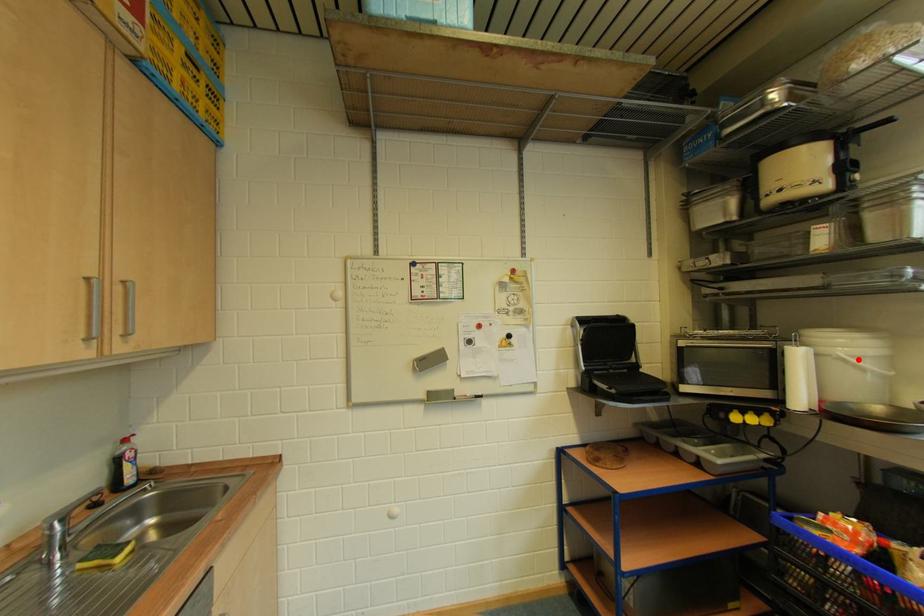
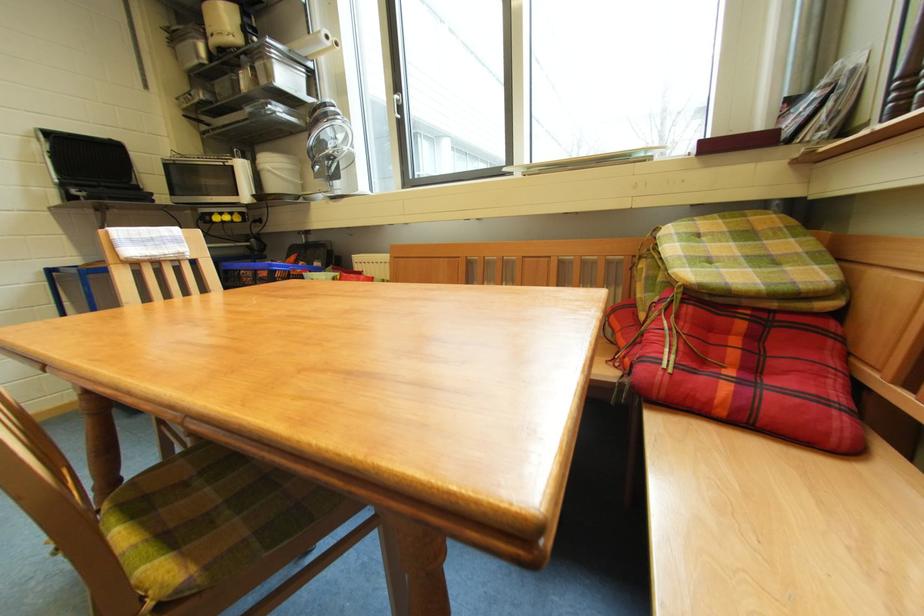
Where in the second image is the point corresponding to the highlighted location from the first image?

(281, 171)